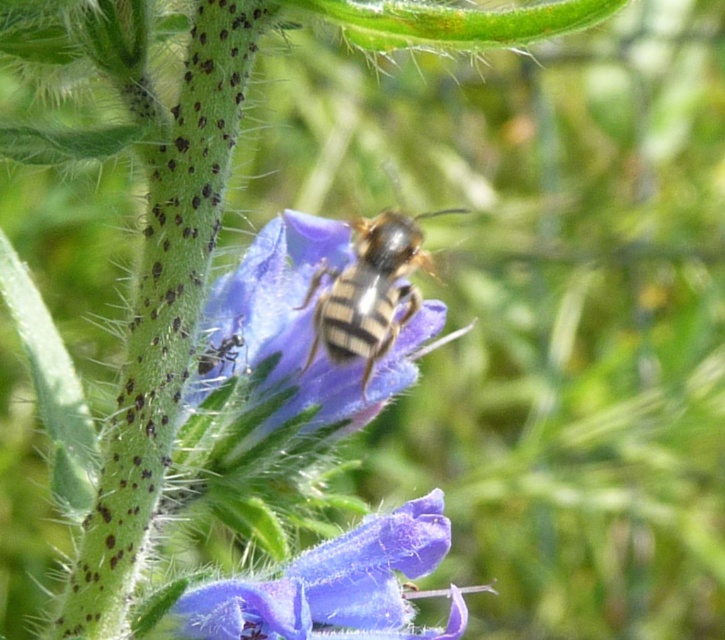
You are observing a bee on a flower. There are two points marked in the image. The first point is at coordinates point (215,627) and the second point is at point (349,346). Which of these two points is nearer to you?

Point (215,627) is closer to the viewer than point (349,346).

You are a photographer trying to capture the striped fur bee at center and the purple matte flower at center in a single shot. Based on their positions, which object should you adjust your camera focus to first to ensure both are in frame?

The purple matte flower at center is to the left of the striped fur bee at center, so you should focus on the striped fur bee at center first to ensure both are in frame.

You are a photographer trying to capture the purple matte flower at center. According to the coordinates provided, where should you focus your camera lens to ensure the flower is in the center of your shot?

The purple matte flower at center is located at coordinates point (336, 586), so you should focus your camera lens at that point to center the flower in your shot.